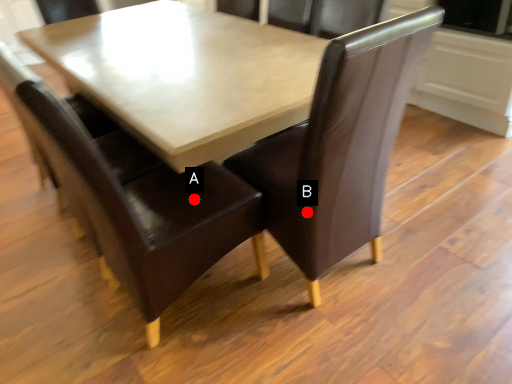
Question: Two points are circled on the image, labeled by A and B beside each circle. Which point appears farthest from the camera in this image?

Choices:
 (A) A is further
 (B) B is further

Answer: (A)